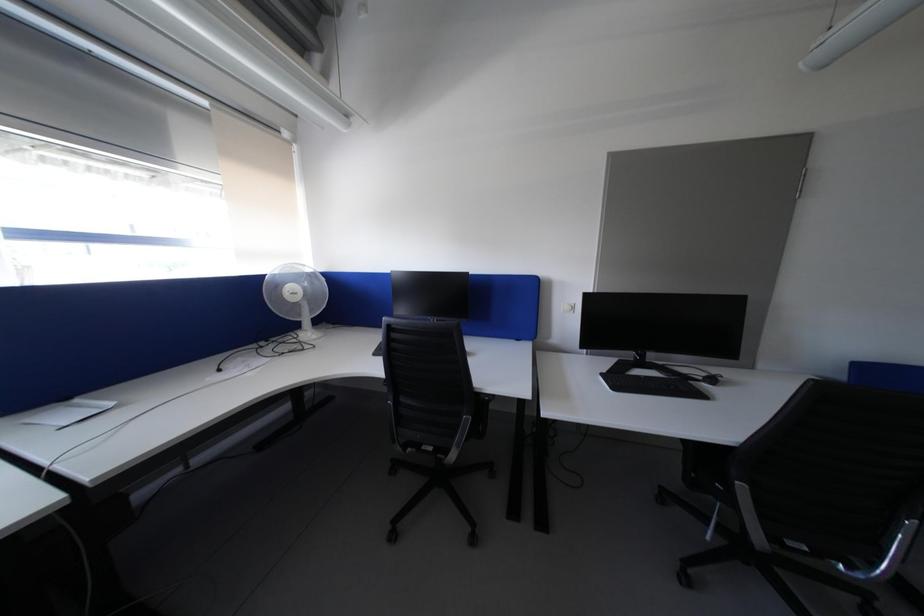
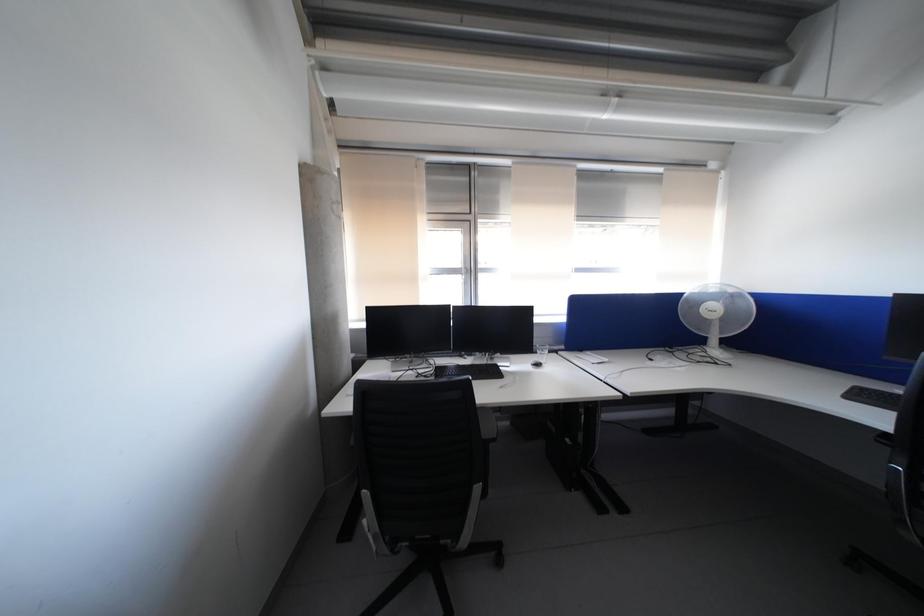
Question: The camera is either moving clockwise (left) or counter-clockwise (right) around the object. The first image is from the beginning of the video and the second image is from the end. Is the camera moving left or right when shooting the video?

Choices:
 (A) Left
 (B) Right

Answer: (B)